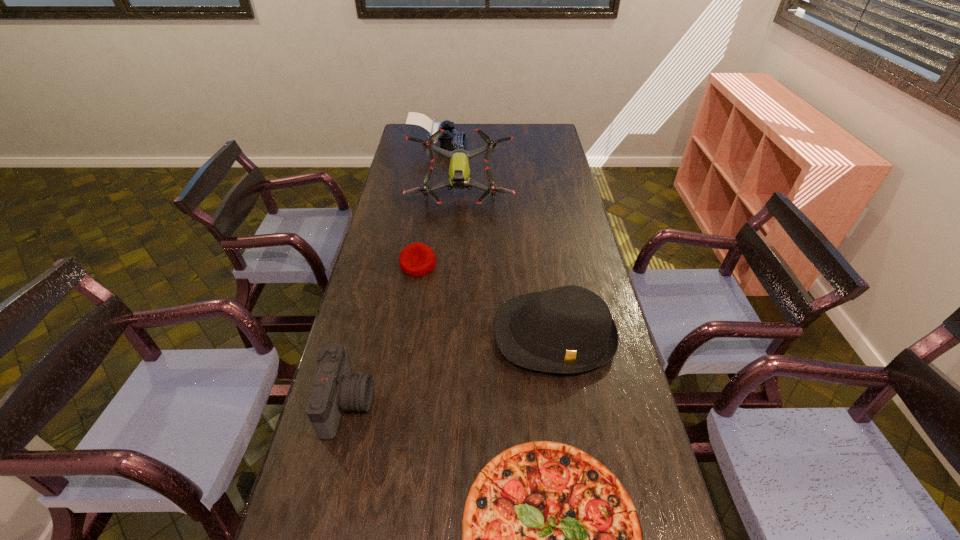
Identify which object is the second nearest to the shortest object. Please provide its 2D coordinates. Your answer should be formatted as a tuple, i.e. [(x, y)], where the tuple contains the x and y coordinates of a point satisfying the conditions above.

[(335, 389)]

Where is `vacant region that satisfies the following two spatial constraints: 1. on the keys of the farthest object; 2. on the seat area of the fifth tallest object`? Image resolution: width=960 pixels, height=540 pixels. vacant region that satisfies the following two spatial constraints: 1. on the keys of the farthest object; 2. on the seat area of the fifth tallest object is located at coordinates (420, 265).

Image resolution: width=960 pixels, height=540 pixels. Identify the location of free spot that satisfies the following two spatial constraints: 1. on the seat area of the beanbag; 2. at the lens of the camera. coord(396,404).

The height and width of the screenshot is (540, 960). In order to click on vacant space that satisfies the following two spatial constraints: 1. on the front-facing side of the fedora; 2. at the lens of the camera in this screenshot , I will do `click(565, 404)`.